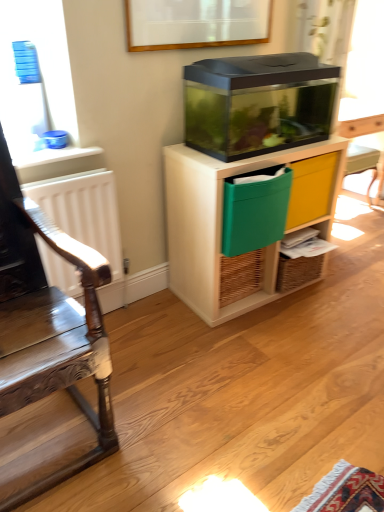
Locate an element on the screen. This screenshot has height=512, width=384. vacant area that lies to the right of transparent plastic cabinet at center is located at coordinates pos(347,295).